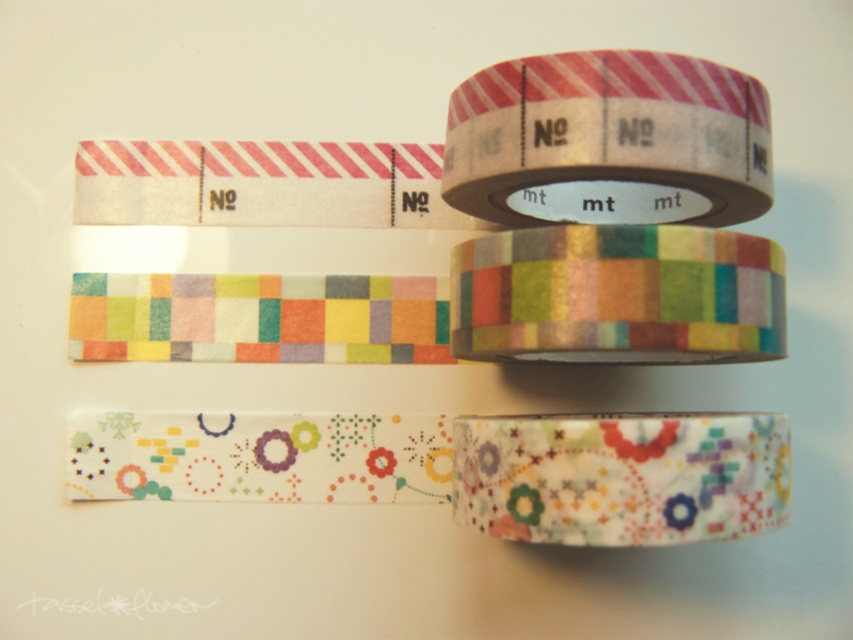
Is striped paper tape at upper right smaller than floral-patterned paper tape at center?

No.

Between striped paper tape at upper right and floral-patterned paper tape at center, which one is positioned lower?

Positioned lower is floral-patterned paper tape at center.

Does point (619, 88) come behind point (758, 497)?

Yes.

This screenshot has height=640, width=853. I want to click on striped paper tape at upper right, so click(x=608, y=141).

Which is behind, point (469, 298) or point (532, 500)?

Positioned behind is point (469, 298).

Is multicolored glossy washi tape at center positioned before floral-patterned paper tape at center?

No, it is behind floral-patterned paper tape at center.

You are a GUI agent. You are given a task and a screenshot of the screen. Output one action in this format:
    pyautogui.click(x=<x>, y=<y>)
    Task: Click on the multicolored glossy washi tape at center
    This screenshot has width=853, height=640.
    Given the screenshot: What is the action you would take?
    pyautogui.click(x=618, y=296)

In the scene shown: Who is higher up, striped paper tape at upper right or multicolored glossy washi tape at center?

striped paper tape at upper right is above.

Is striped paper tape at upper right closer to camera compared to multicolored glossy washi tape at center?

No, striped paper tape at upper right is behind multicolored glossy washi tape at center.

The width and height of the screenshot is (853, 640). What are the coordinates of `striped paper tape at upper right` in the screenshot? It's located at (608, 141).

Find the location of a particular element. striped paper tape at upper right is located at coordinates (608, 141).